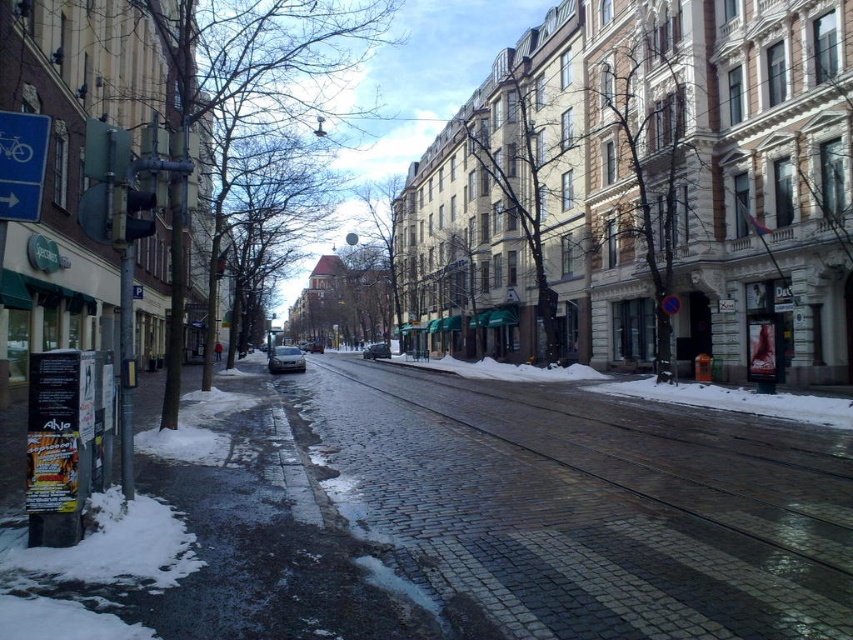
You are a delivery driver who needs to park your 5.5 meter long truck between the satin silver car at center and the black glossy car at center. Can you fit your truck in the space between them without overlapping either car?

The distance between the satin silver car at center and the black glossy car at center is 23.67 meters. Since your truck is only 5.5 meters long, there is more than enough space to park it between them without overlapping either car.

From the picture: You are a delivery person trying to park your satin silver car at center on the dark gray cobblestone pavement at center. Can you park your car there without it hanging over the edge of the pavement?

The dark gray cobblestone pavement at center is located below the satin silver car at center, which means the car is already positioned on the pavement. Therefore, it is possible to park the car there without it hanging over the edge.

You are standing on the sidewalk looking at the urban street scene. There are two points marked in the image. The first point is at coordinates point [532,568] and the second is at point [369,346]. Which of these two points is nearer to your current position?

Point [532,568] is closer to the camera than point [369,346], so the first point is nearer to your current position.